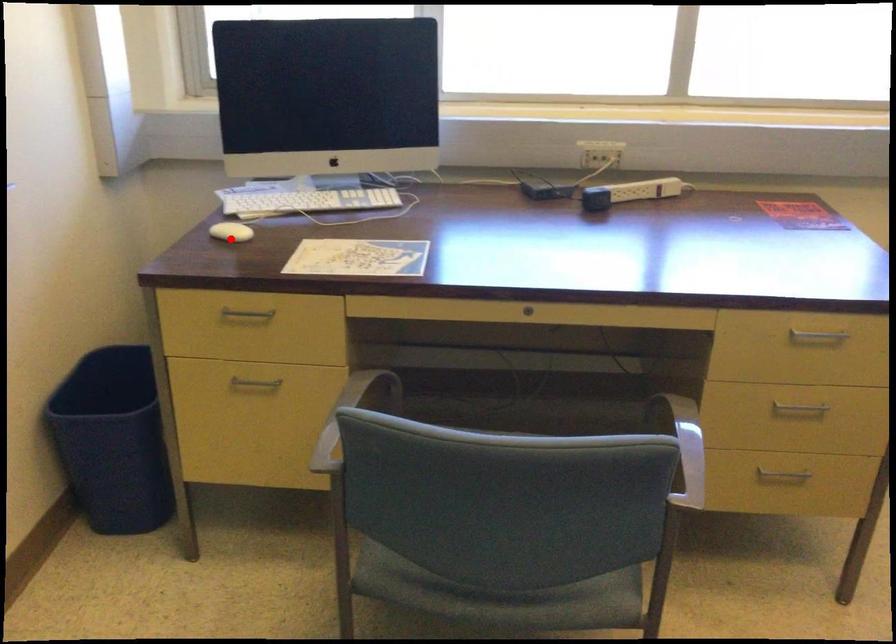
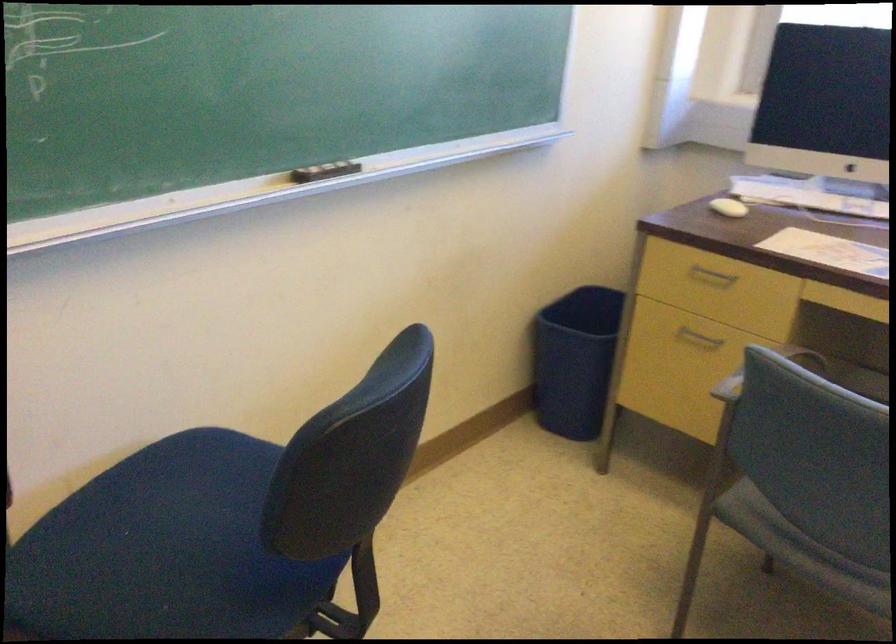
Question: I am providing you with two images of the same scene from different viewpoints. A red point is marked on the first image. Is the red point's position out of view in image 2?

Choices:
 (A) Yes
 (B) No

Answer: (B)